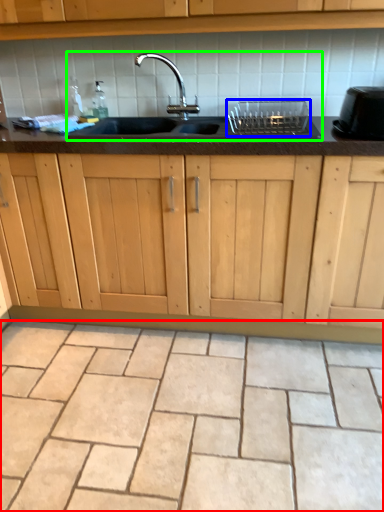
Question: Which is farther away from ceramic tile (highlighted by a red box)? appliance (highlighted by a blue box) or sink (highlighted by a green box)?

Choices:
 (A) appliance
 (B) sink

Answer: (A)